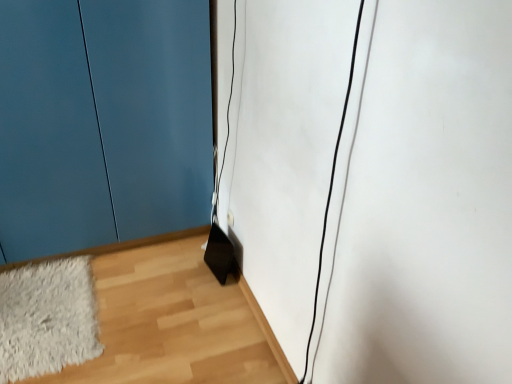
Question: Should I look upward or downward to see matte blue door at lower left?

Choices:
 (A) down
 (B) up

Answer: (B)

Question: Is white fluffy rug at lower left at the right side of wooden floor at lower right?

Choices:
 (A) no
 (B) yes

Answer: (A)

Question: Does white fluffy rug at lower left have a larger size compared to wooden floor at lower right?

Choices:
 (A) no
 (B) yes

Answer: (A)

Question: Can you confirm if white fluffy rug at lower left is positioned to the left of wooden floor at lower right?

Choices:
 (A) no
 (B) yes

Answer: (B)

Question: From a real-world perspective, is white fluffy rug at lower left located beneath wooden floor at lower right?

Choices:
 (A) yes
 (B) no

Answer: (B)

Question: From the image's perspective, is white fluffy rug at lower left on top of wooden floor at lower right?

Choices:
 (A) no
 (B) yes

Answer: (A)

Question: Considering the relative sizes of white fluffy rug at lower left and wooden floor at lower right in the image provided, is white fluffy rug at lower left thinner than wooden floor at lower right?

Choices:
 (A) yes
 (B) no

Answer: (A)

Question: Is wooden floor at lower right facing towards matte blue door at lower left?

Choices:
 (A) yes
 (B) no

Answer: (B)

Question: Can you confirm if wooden floor at lower right is wider than matte blue door at lower left?

Choices:
 (A) yes
 (B) no

Answer: (A)

Question: Does wooden floor at lower right have a greater height compared to matte blue door at lower left?

Choices:
 (A) no
 (B) yes

Answer: (A)

Question: From the image's perspective, does wooden floor at lower right appear higher than matte blue door at lower left?

Choices:
 (A) no
 (B) yes

Answer: (A)

Question: Is matte blue door at lower left a part of wooden floor at lower right?

Choices:
 (A) no
 (B) yes

Answer: (A)

Question: Considering the relative sizes of wooden floor at lower right and matte blue door at lower left in the image provided, is wooden floor at lower right smaller than matte blue door at lower left?

Choices:
 (A) yes
 (B) no

Answer: (A)

Question: Does matte blue door at lower left have a larger size compared to white fluffy rug at lower left?

Choices:
 (A) yes
 (B) no

Answer: (A)